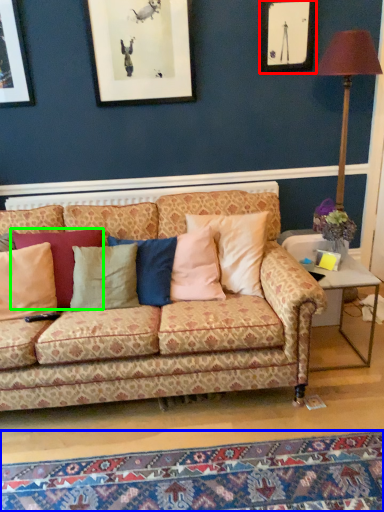
Question: Estimate the real-world distances between objects in this image. Which object is closer to picture frame (highlighted by a red box), mat (highlighted by a blue box) or pillow (highlighted by a green box)?

Choices:
 (A) mat
 (B) pillow

Answer: (B)